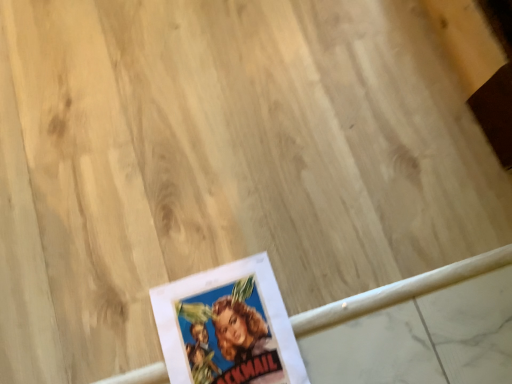
Locate an element on the screen. vacant space to the right of matte paper picture frame at lower center is located at coordinates (368, 319).